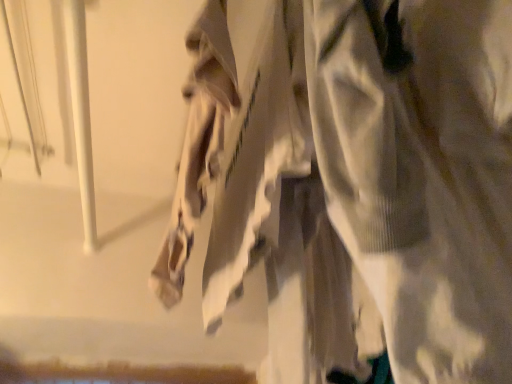
The image size is (512, 384). Describe the element at coordinates (354, 182) in the screenshot. I see `white sheer fabric at center` at that location.

Locate an element on the screen. white sheer fabric at center is located at coordinates (354, 182).

Identify the location of white sheer fabric at center. (354, 182).